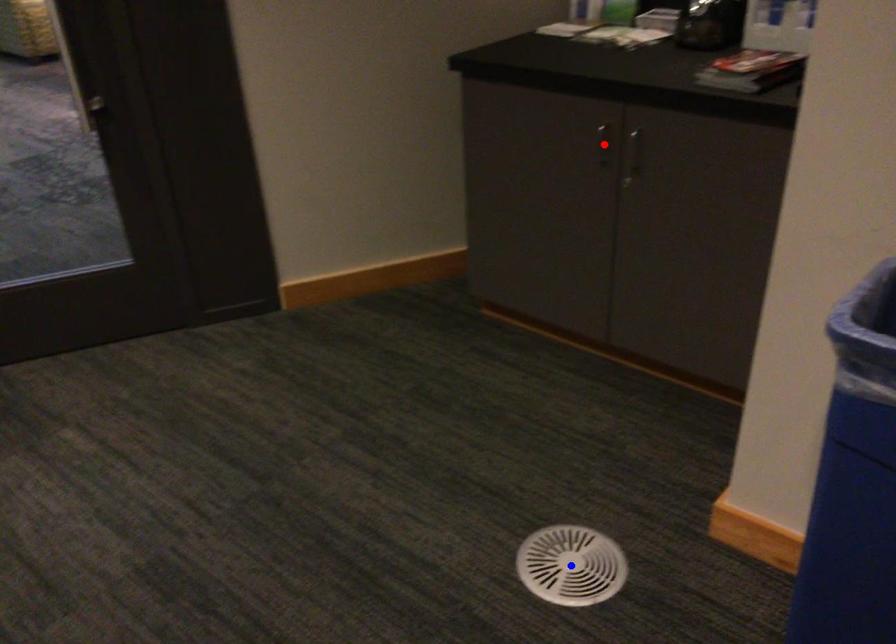
Question: Which of the two points in the image is closer to the camera?

Choices:
 (A) Blue point is closer.
 (B) Red point is closer.

Answer: (A)